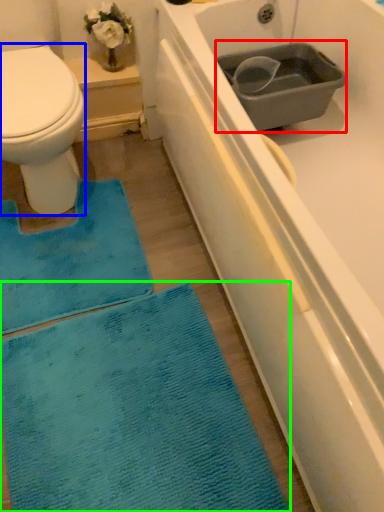
Question: Based on their relative distances, which object is farther from sink (highlighted by a red box)? Choose from bidet (highlighted by a blue box) and bath mat (highlighted by a green box).

Choices:
 (A) bidet
 (B) bath mat

Answer: (B)